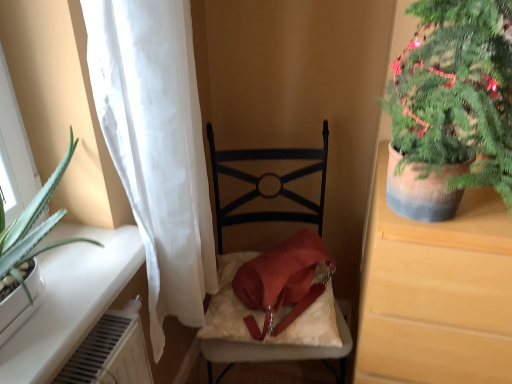
Question: Is matte black chair at center bigger than matte brown cabinet at right?

Choices:
 (A) yes
 (B) no

Answer: (B)

Question: From the image's perspective, is matte black chair at center located beneath matte brown cabinet at right?

Choices:
 (A) no
 (B) yes

Answer: (A)

Question: Is matte black chair at center in contact with matte brown cabinet at right?

Choices:
 (A) no
 (B) yes

Answer: (A)

Question: Is matte black chair at center not close to matte brown cabinet at right?

Choices:
 (A) yes
 (B) no

Answer: (B)

Question: Is matte black chair at center not within matte brown cabinet at right?

Choices:
 (A) yes
 (B) no

Answer: (A)

Question: Can you confirm if matte black chair at center is thinner than matte brown cabinet at right?

Choices:
 (A) no
 (B) yes

Answer: (A)

Question: From the image's perspective, is green textured plant at upper right beneath matte brown cabinet at right?

Choices:
 (A) no
 (B) yes

Answer: (A)

Question: Does green textured plant at upper right appear on the left side of matte brown cabinet at right?

Choices:
 (A) yes
 (B) no

Answer: (A)

Question: Can you confirm if green textured plant at upper right is positioned to the right of matte brown cabinet at right?

Choices:
 (A) yes
 (B) no

Answer: (B)

Question: From a real-world perspective, does green textured plant at upper right stand above matte brown cabinet at right?

Choices:
 (A) no
 (B) yes

Answer: (B)

Question: Is green textured plant at upper right taller than matte brown cabinet at right?

Choices:
 (A) no
 (B) yes

Answer: (A)

Question: Does green textured plant at upper right have a larger size compared to matte brown cabinet at right?

Choices:
 (A) no
 (B) yes

Answer: (A)

Question: Does white sheer curtain at left touch matte brown cabinet at right?

Choices:
 (A) yes
 (B) no

Answer: (B)